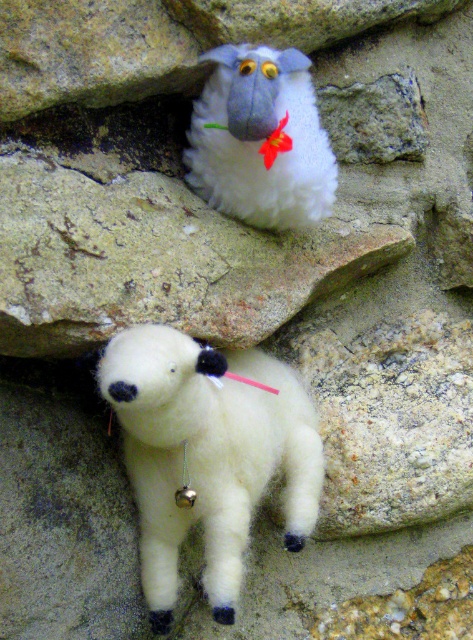
Is white fluffy lamb at lower center positioned before white fluffy sheep at upper center?

Yes, it is in front of white fluffy sheep at upper center.

Between white fluffy lamb at lower center and white fluffy sheep at upper center, which one is positioned higher?

white fluffy sheep at upper center is above.

Identify the location of white fluffy lamb at lower center. (208, 456).

The height and width of the screenshot is (640, 473). I want to click on white fluffy lamb at lower center, so click(x=208, y=456).